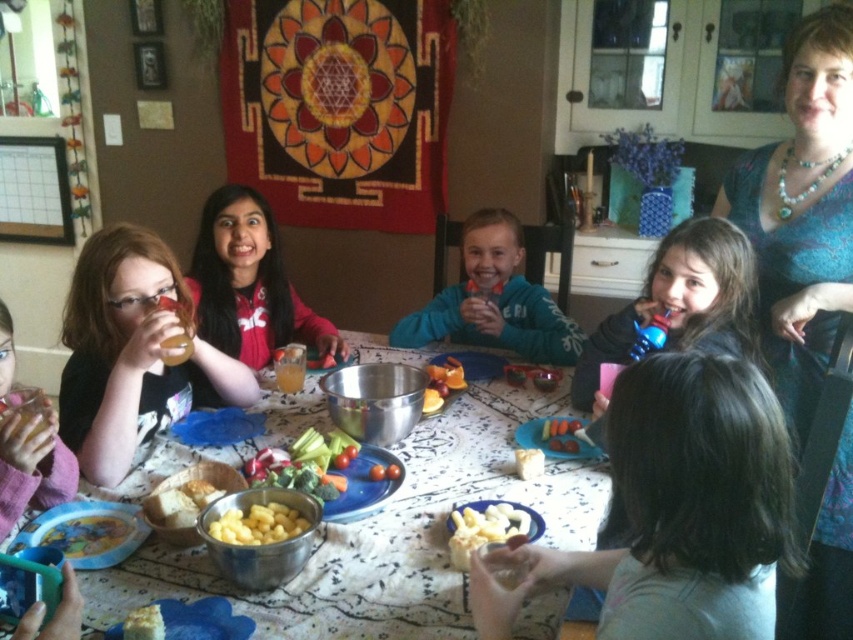
You are a parent at the dining table and want to reach both the pink fabric bib at lower left and the smooth yellow cheese at center to give to your child. How far apart are these two items from each other?

The pink fabric bib at lower left and smooth yellow cheese at center are 36.80 inches apart from each other.

You are standing at the dining table and want to reach both the point at coordinates point (x=518, y=513) and point (x=538, y=472). Which point will you reach first?

Point (x=518, y=513) is closer to the viewer than point (x=538, y=472), so you will reach point (x=518, y=513) first.